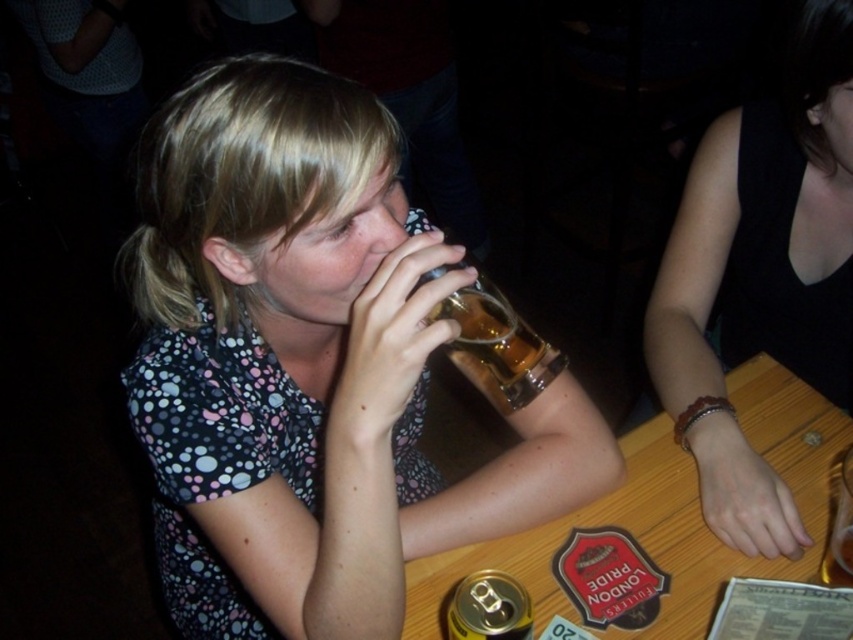
Question: Does black matte tank top at upper right come behind gold metallic can at lower center?

Choices:
 (A) no
 (B) yes

Answer: (B)

Question: Which point is closer to the camera taking this photo?

Choices:
 (A) (836, 572)
 (B) (691, 472)
 (C) (357, 243)

Answer: (C)

Question: Estimate the real-world distances between objects in this image. Which object is farther from the gold metallic can at lower center?

Choices:
 (A) translucent glass mug at upper center
 (B) wooden table at center
 (C) matte glass mug at center
 (D) black matte tank top at upper right

Answer: (D)

Question: Which object is the farthest from the translucent glass mug at upper center?

Choices:
 (A) matte glass mug at center
 (B) wooden table at center

Answer: (A)

Question: Can you confirm if wooden table at center is bigger than gold metallic can at lower center?

Choices:
 (A) no
 (B) yes

Answer: (B)

Question: Does black matte tank top at upper right come behind translucent glass mug at upper center?

Choices:
 (A) no
 (B) yes

Answer: (B)